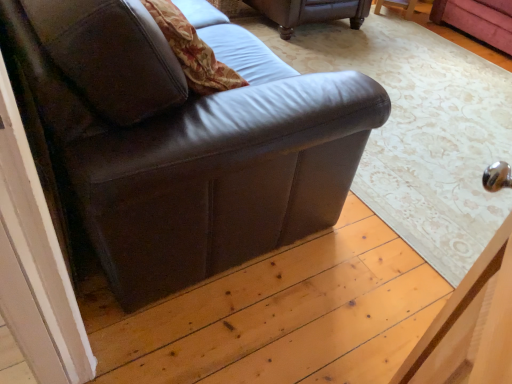
Question: Visually, is matte brown leather couch at left, which is the 2th studio couch from back to front, positioned to the left or to the right of brown leather couch at upper center, which ranks as the 2th studio couch in front-to-back order?

Choices:
 (A) right
 (B) left

Answer: (B)

Question: Considering the positions of matte brown leather couch at left, the first studio couch positioned from the front, and brown leather couch at upper center, which ranks as the 2th studio couch in front-to-back order, in the image, is matte brown leather couch at left, the first studio couch positioned from the front, wider or thinner than brown leather couch at upper center, which ranks as the 2th studio couch in front-to-back order,?

Choices:
 (A) wide
 (B) thin

Answer: (B)

Question: From a real-world perspective, is matte brown leather couch at left, the first studio couch positioned from the front, above or below brown leather couch at upper center, which is counted as the 1th studio couch, starting from the back?

Choices:
 (A) above
 (B) below

Answer: (A)

Question: Looking at the image, does brown leather couch at upper center, which ranks as the 2th studio couch in front-to-back order, seem bigger or smaller compared to matte brown leather couch at left, which is the 2th studio couch from back to front?

Choices:
 (A) small
 (B) big

Answer: (A)

Question: From the image's perspective, relative to matte brown leather couch at left, which is the 2th studio couch from back to front, is brown leather couch at upper center, which ranks as the 2th studio couch in front-to-back order, above or below?

Choices:
 (A) above
 (B) below

Answer: (A)

Question: Considering the positions of brown leather couch at upper center, which is counted as the 1th studio couch, starting from the back, and matte brown leather couch at left, the first studio couch positioned from the front, in the image, is brown leather couch at upper center, which is counted as the 1th studio couch, starting from the back, taller or shorter than matte brown leather couch at left, the first studio couch positioned from the front,?

Choices:
 (A) short
 (B) tall

Answer: (A)

Question: Which is correct: brown leather couch at upper center, which ranks as the 2th studio couch in front-to-back order, is inside matte brown leather couch at left, which is the 2th studio couch from back to front, or outside of it?

Choices:
 (A) outside
 (B) inside

Answer: (A)